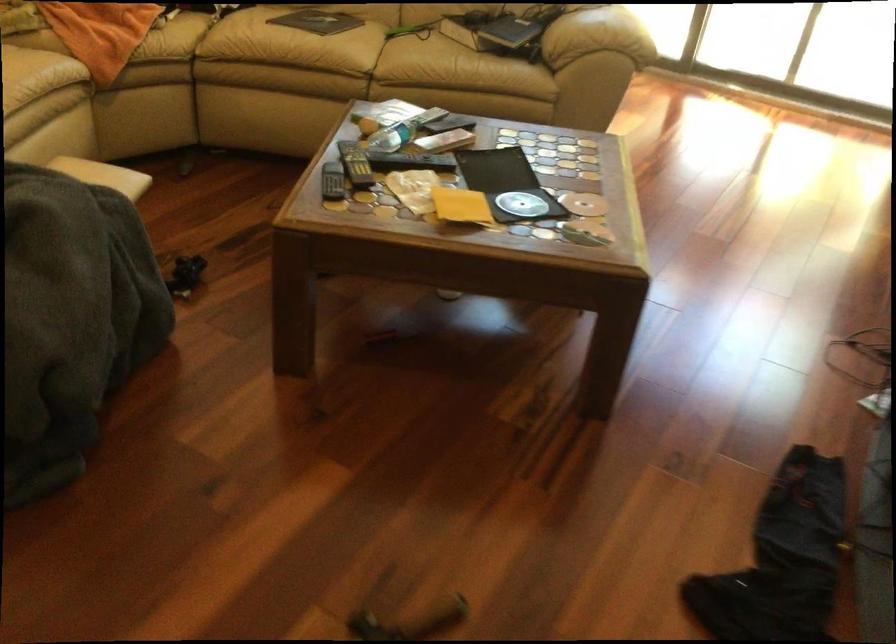
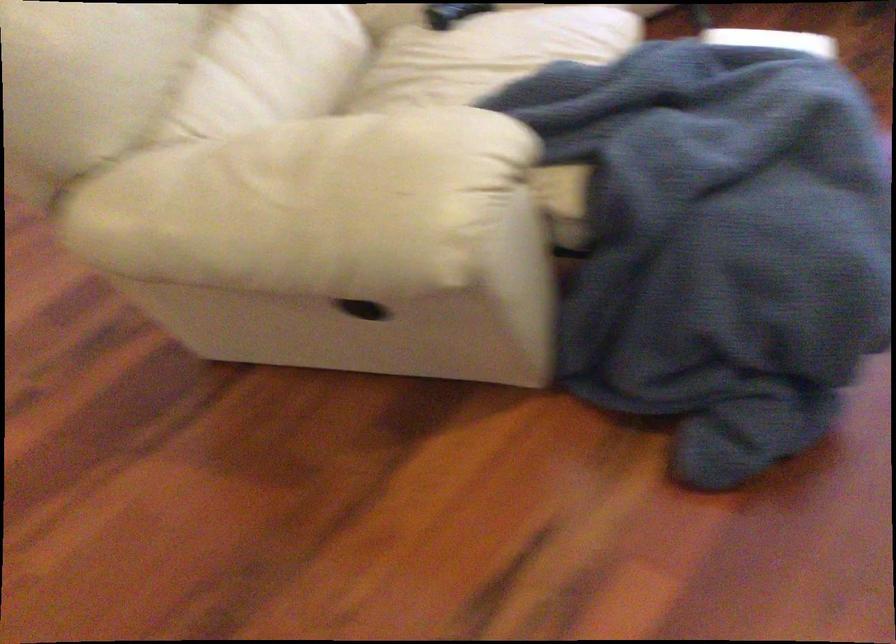
Question: In a continuous first-person perspective shot, in which direction is the camera moving?

Choices:
 (A) Left
 (B) Right
 (C) Forward
 (D) Backward

Answer: (A)